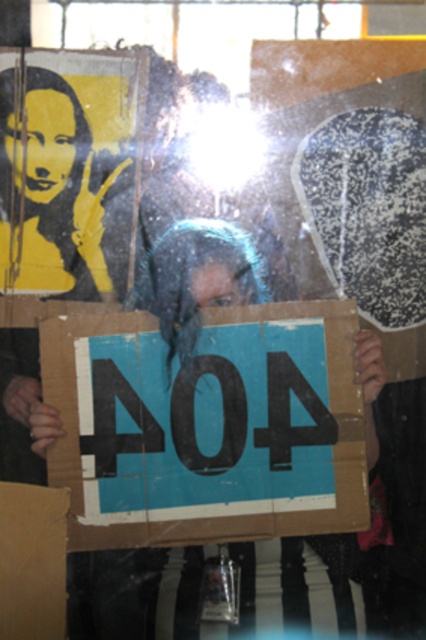
Question: Does blue cardboard sign at center have a smaller size compared to brown cardboard at lower left?

Choices:
 (A) no
 (B) yes

Answer: (A)

Question: Which point is farther from the camera taking this photo?

Choices:
 (A) (14, 500)
 (B) (244, 448)

Answer: (B)

Question: Does blue cardboard sign at center lie behind brown cardboard at lower left?

Choices:
 (A) no
 (B) yes

Answer: (B)

Question: Is blue cardboard sign at center further to the viewer compared to brown cardboard at lower left?

Choices:
 (A) no
 (B) yes

Answer: (B)

Question: Which object is closer to the camera taking this photo?

Choices:
 (A) blue cardboard sign at center
 (B) brown cardboard at lower left

Answer: (B)